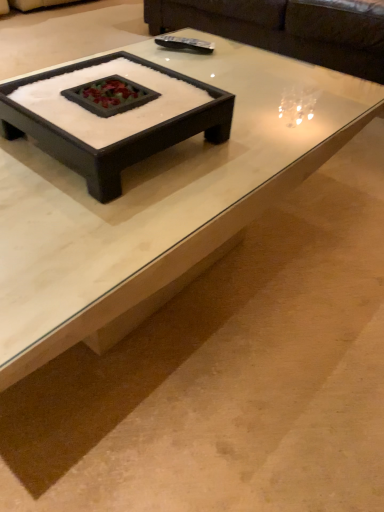
Question: From the image's perspective, is dark brown leather couch at upper center above or below black matte tray at center, the second coffee table in the front-to-back sequence?

Choices:
 (A) above
 (B) below

Answer: (A)

Question: Is dark brown leather couch at upper center in front of or behind black matte tray at center, placed as the 1th coffee table when sorted from back to front, in the image?

Choices:
 (A) behind
 (B) front

Answer: (A)

Question: Which object is positioned farthest from the white glossy coffee table at center, the 2th coffee table viewed from the back?

Choices:
 (A) dark brown leather couch at upper center
 (B) black matte tray at center, the second coffee table in the front-to-back sequence

Answer: (A)

Question: Estimate the real-world distances between objects in this image. Which object is closer to the white glossy coffee table at center, which appears as the first coffee table when viewed from the front?

Choices:
 (A) black matte tray at center, the second coffee table in the front-to-back sequence
 (B) dark brown leather couch at upper center

Answer: (A)